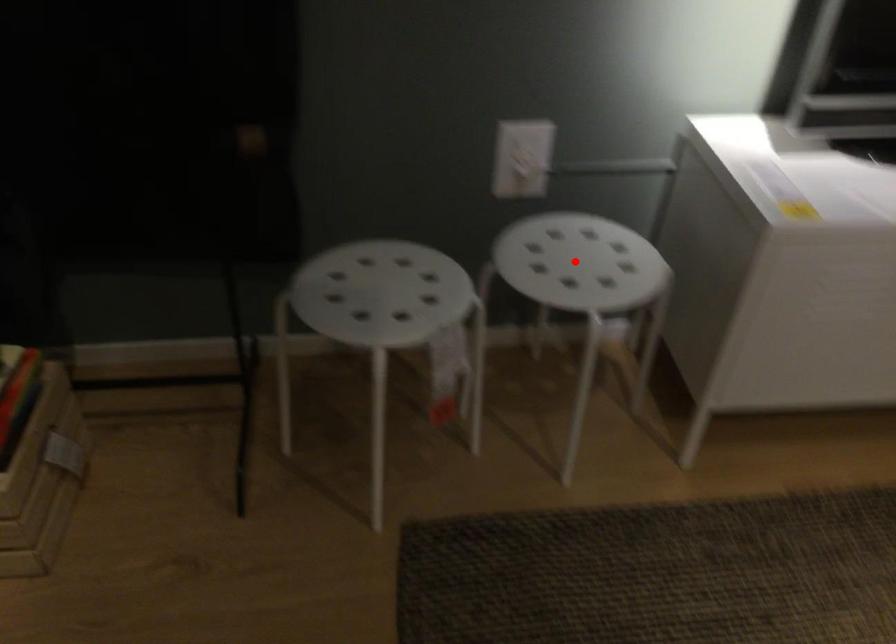
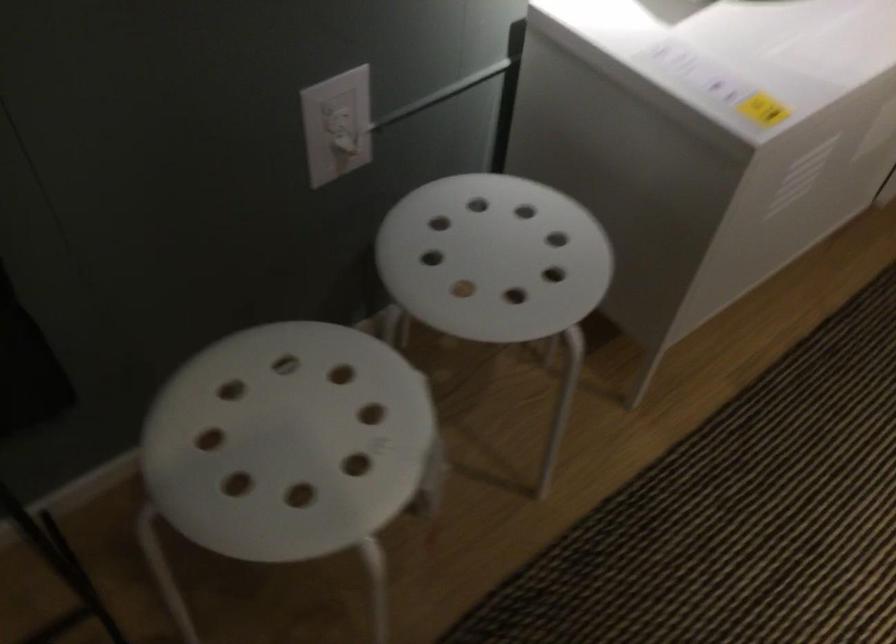
Find the pixel in the second image that matches the highlighted location in the first image.

(494, 258)